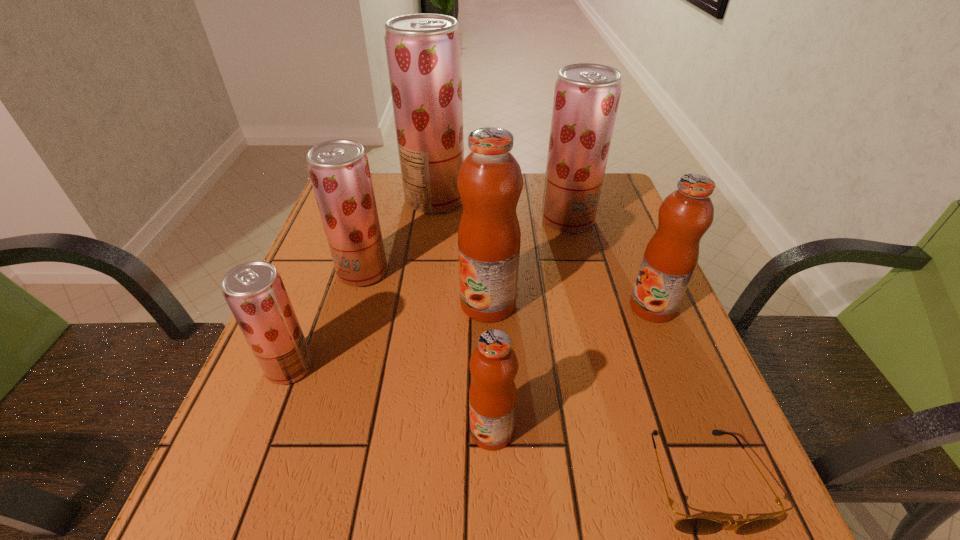
The width and height of the screenshot is (960, 540). In order to click on the third strawberry fruit juice from left to right in this screenshot , I will do `click(423, 51)`.

This screenshot has height=540, width=960. Identify the location of the tallest object. (423, 51).

Identify the location of the second biggest strawberry fruit juice. The width and height of the screenshot is (960, 540). (586, 98).

What are the coordinates of `the second fruit juice from right to left` in the screenshot? It's located at (586, 98).

Where is `the biggest orange fruit juice`? Image resolution: width=960 pixels, height=540 pixels. the biggest orange fruit juice is located at coordinates (490, 182).

Identify the location of the third biggest strawberry fruit juice. This screenshot has width=960, height=540. (339, 170).

You are a GUI agent. You are given a task and a screenshot of the screen. Output one action in this format:
    pyautogui.click(x=<x>, y=<y>)
    Task: Click on the second biggest orange fruit juice
    The height and width of the screenshot is (540, 960).
    Given the screenshot: What is the action you would take?
    pyautogui.click(x=671, y=255)

Locate an element on the screen. Image resolution: width=960 pixels, height=540 pixels. the rightmost fruit juice is located at coordinates (671, 255).

You are a GUI agent. You are given a task and a screenshot of the screen. Output one action in this format:
    pyautogui.click(x=<x>, y=<y>)
    Task: Click on the nearest strawberry fruit juice
    The width and height of the screenshot is (960, 540).
    Given the screenshot: What is the action you would take?
    pyautogui.click(x=254, y=291)

You are a GUI agent. You are given a task and a screenshot of the screen. Output one action in this format:
    pyautogui.click(x=<x>, y=<y>)
    Task: Click on the third nearest object
    This screenshot has height=540, width=960.
    Given the screenshot: What is the action you would take?
    pyautogui.click(x=254, y=291)